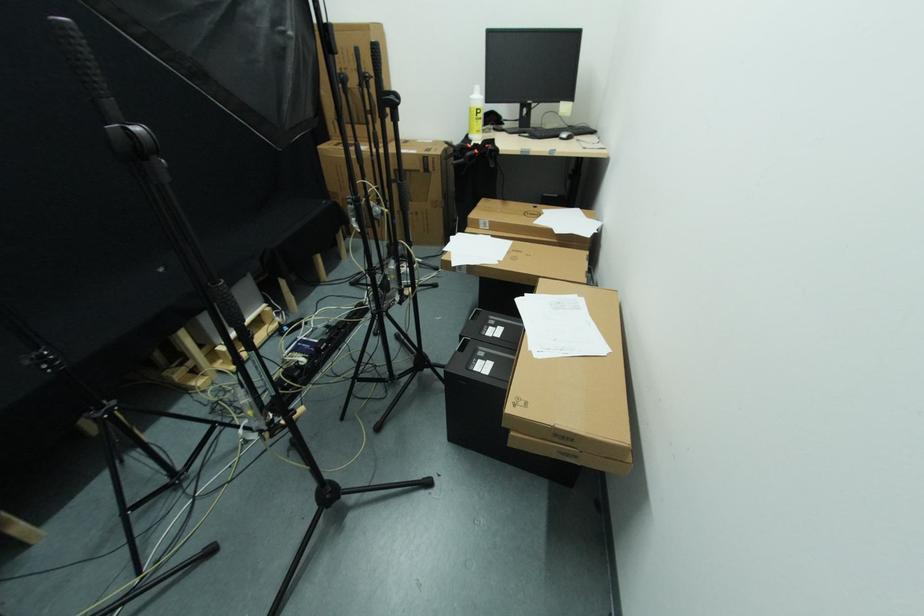
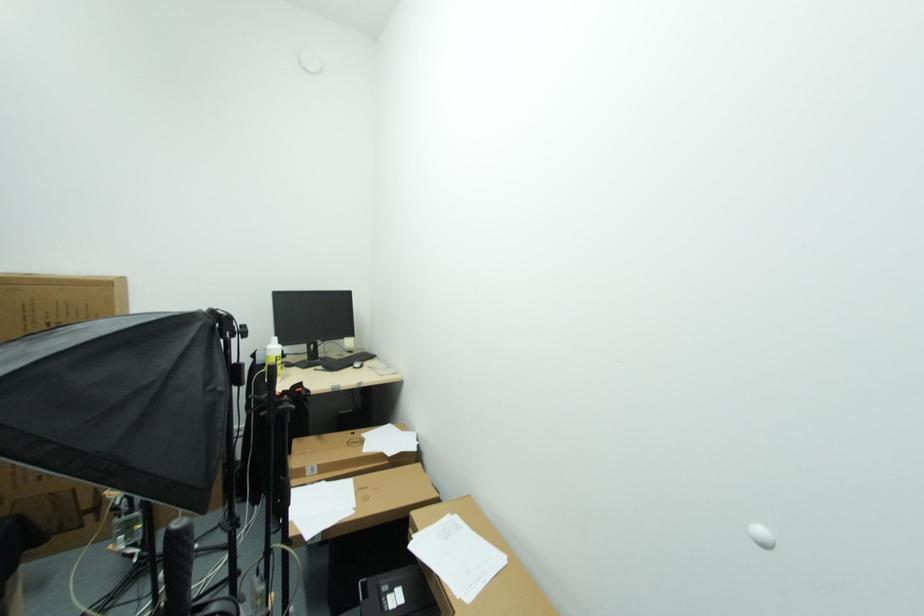
Find the pixel in the second image that matches point (481, 114) in the first image.

(280, 361)